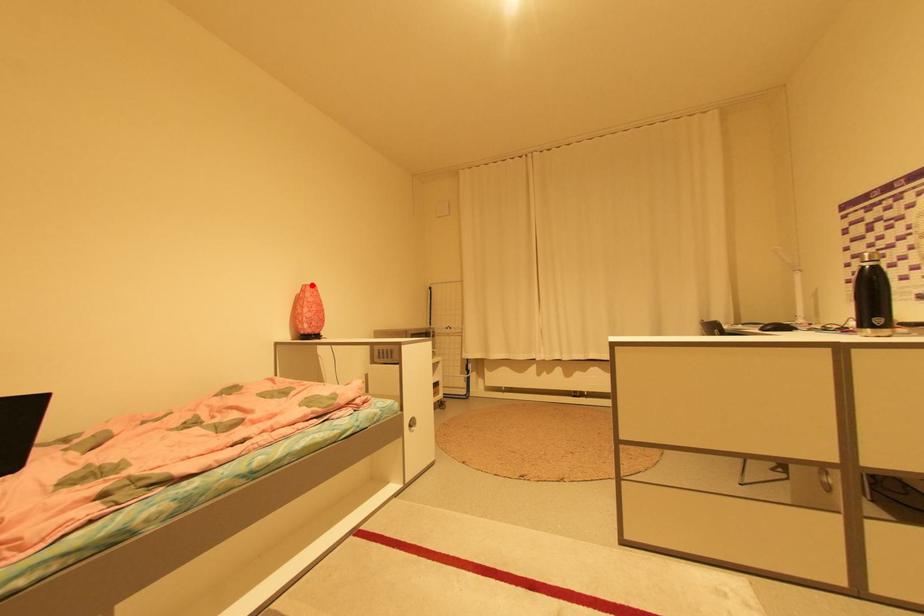
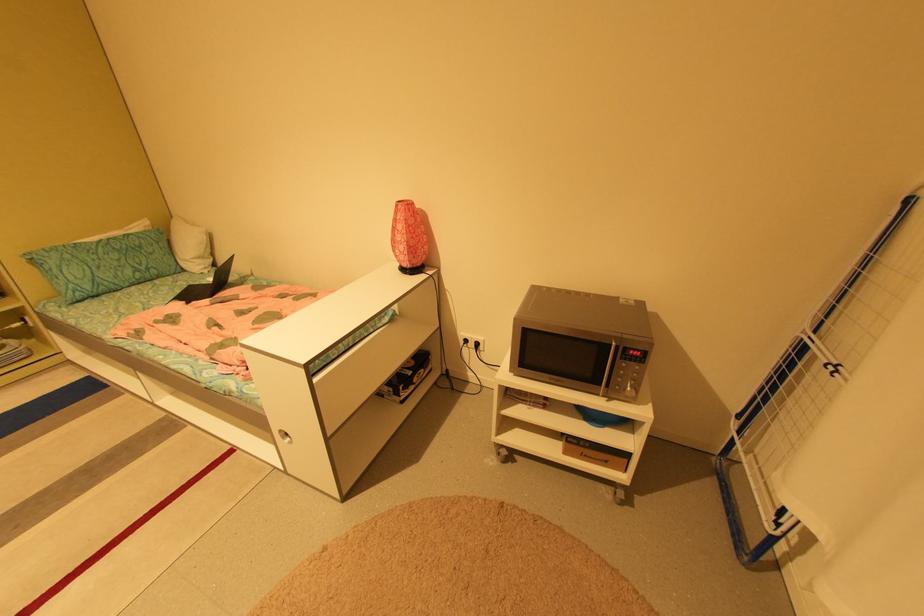
In the second image, find the point that corresponds to the highlighted location in the first image.

(406, 201)